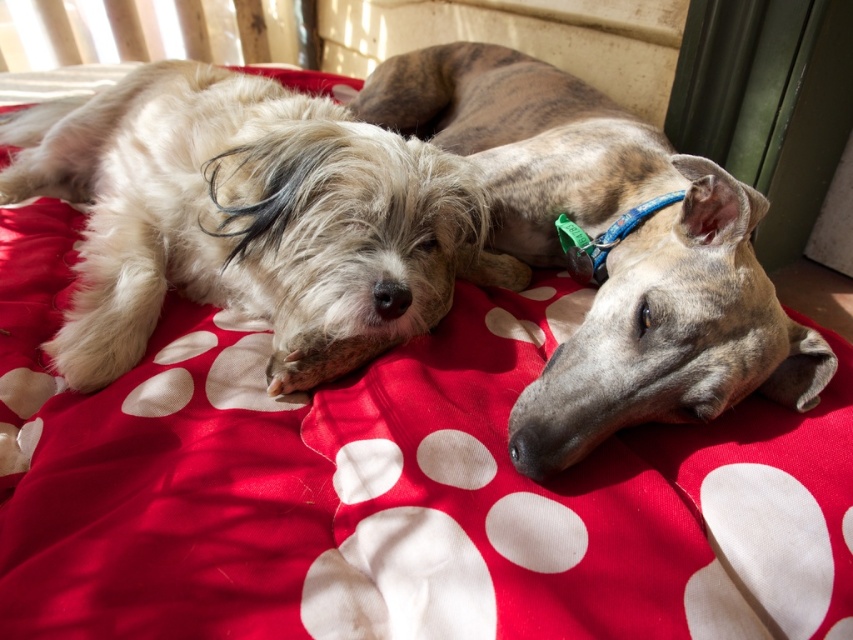
You are taking a photo of the two dogs resting on the cushion. You want to focus on the point closer to the camera. Which point should you choose between point [193,182] and point [610,195]?

Point [193,182] is closer to the camera than point [610,195], so you should choose point [193,182] to focus on.

You are a dog sitter who needs to choose the right size bed for each dog. Given that the shaggy beige dog at left and the speckled fur dog at center are both resting on a red cushion, which dog requires a larger bed?

The speckled fur dog at center requires a larger bed because it is bigger than the shaggy beige dog at left.

You are a photographer trying to capture a closeup of the shaggy beige dog at left and the speckled fur dog at center. Based on their positions, which dog would you need to focus on first if you start from the bottom of the image?

The shaggy beige dog at left is located below the speckled fur dog at center, so you should focus on the shaggy beige dog at left first since it is lower in the image.